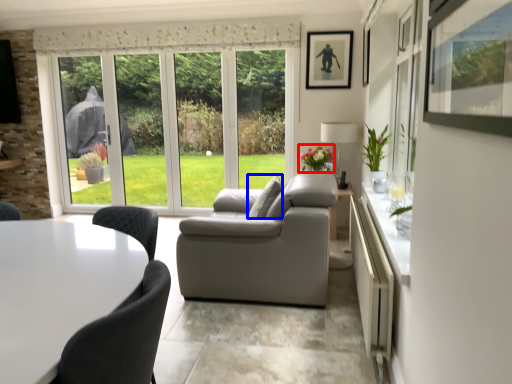
Question: Which point is closer to the camera, flower (highlighted by a red box) or pillow (highlighted by a blue box)?

Choices:
 (A) flower
 (B) pillow

Answer: (B)